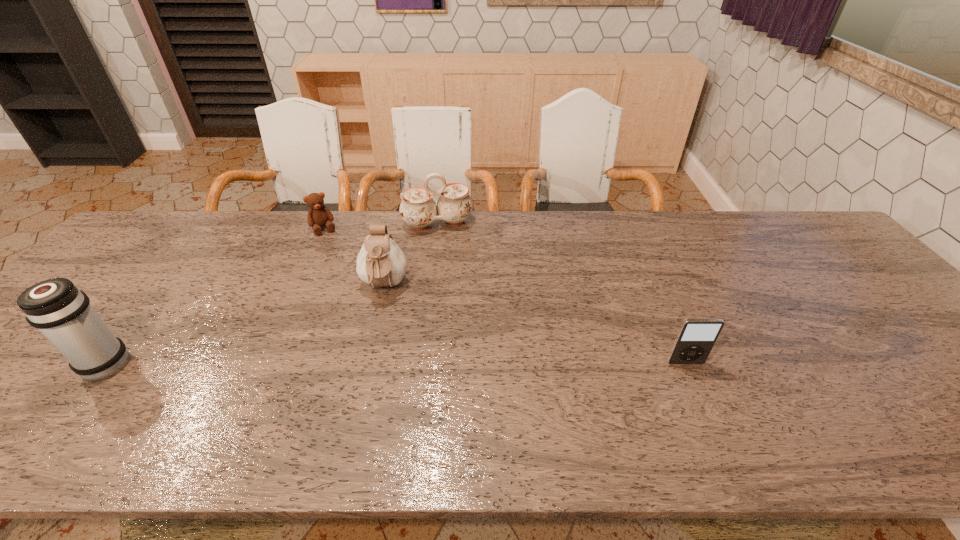
This screenshot has width=960, height=540. In order to click on vacant space located on the side with the handle of the thermos bottle in this screenshot , I will do `click(37, 365)`.

The height and width of the screenshot is (540, 960). Identify the location of vacant space located on the front-facing side of the rightmost object. (694, 383).

Identify the location of free region located on the face of the shortest object. (333, 248).

Locate an element on the screen. free space located on the face of the shortest object is located at coordinates (335, 252).

Where is `blank space located 0.200m on the face of the shortest object`? The image size is (960, 540). blank space located 0.200m on the face of the shortest object is located at coordinates (345, 272).

Identify the location of blank area located 0.100m on the front-facing side of the third nearest object. click(x=378, y=336).

Identify the location of free location located 0.140m on the front-facing side of the third nearest object. This screenshot has width=960, height=540. (376, 348).

Where is `blank space located 0.260m on the front-facing side of the third nearest object`? blank space located 0.260m on the front-facing side of the third nearest object is located at coordinates (372, 391).

Identify the location of free space located by the handle of the chinaware. The width and height of the screenshot is (960, 540). (462, 299).

In order to click on free space located by the handle of the chinaware in this screenshot , I will do `click(451, 260)`.